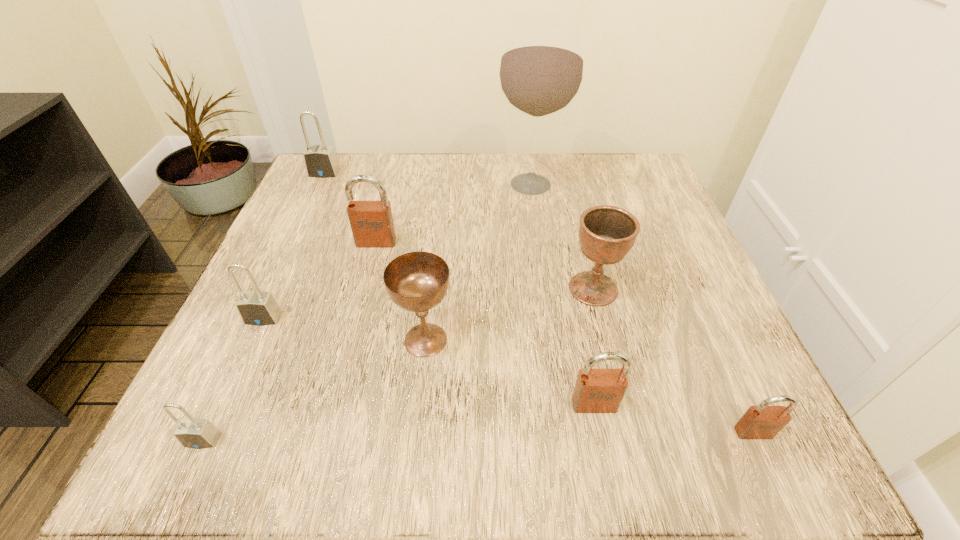
You are a GUI agent. You are given a task and a screenshot of the screen. Output one action in this format:
    pyautogui.click(x=<x>, y=<y>)
    Task: Click on the alcohol
    This screenshot has width=960, height=540.
    Given the screenshot: What is the action you would take?
    pyautogui.click(x=541, y=69)

Identify the location of red alcohol. (541, 69).

At what (x,y) coordinates should I click in order to perform the action: click on the farthest gray padlock. Please return your answer as a coordinate pair (x, y). The width and height of the screenshot is (960, 540). Looking at the image, I should click on (320, 161).

The width and height of the screenshot is (960, 540). Find the location of `the biggest gray padlock`. the biggest gray padlock is located at coordinates [x=320, y=161].

Image resolution: width=960 pixels, height=540 pixels. I want to click on the farthest brown padlock, so click(x=371, y=222).

Locate an element on the screen. This screenshot has width=960, height=540. the second farthest padlock is located at coordinates (371, 222).

Where is `the sixth nearest object`? Image resolution: width=960 pixels, height=540 pixels. the sixth nearest object is located at coordinates (607, 233).

Find the location of a particular element. the farther chalice is located at coordinates (607, 233).

The width and height of the screenshot is (960, 540). I want to click on the nearer chalice, so (x=417, y=281).

At what (x,y) coordinates should I click in order to perform the action: click on the left chalice. Please return your answer as a coordinate pair (x, y). The height and width of the screenshot is (540, 960). Looking at the image, I should click on (417, 281).